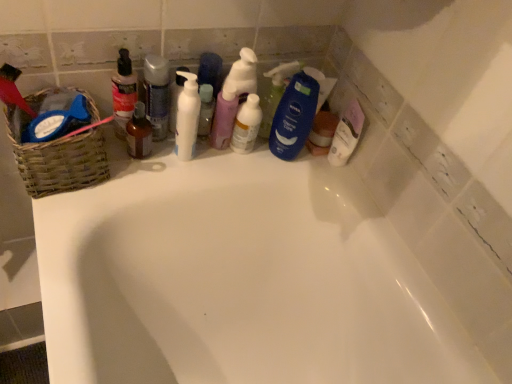
Where is `free location to the right of translucent plastic spray bottle at center, the first cleaning product in the left-to-right sequence`? free location to the right of translucent plastic spray bottle at center, the first cleaning product in the left-to-right sequence is located at coordinates (221, 163).